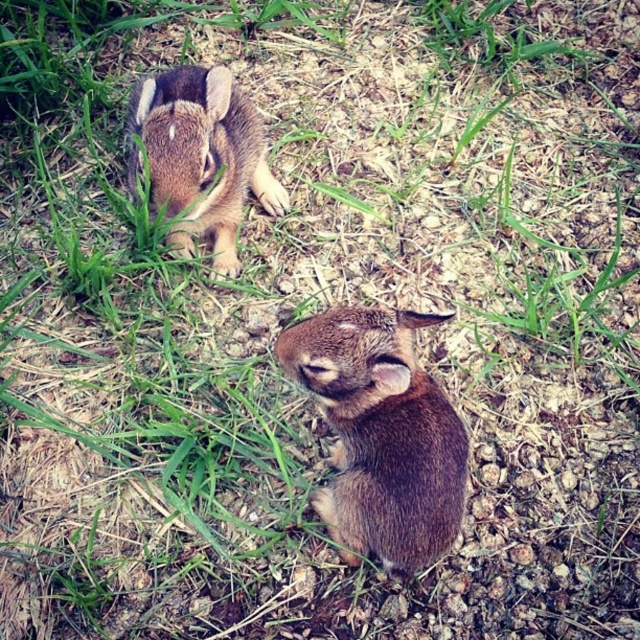
Question: Does brown furry rabbit at center come behind brown furry rabbit at upper left?

Choices:
 (A) no
 (B) yes

Answer: (A)

Question: Is brown furry rabbit at center closer to camera compared to brown furry rabbit at upper left?

Choices:
 (A) no
 (B) yes

Answer: (B)

Question: Which point is farther to the camera?

Choices:
 (A) (353, 346)
 (B) (246, 182)

Answer: (B)

Question: Is the position of brown furry rabbit at center more distant than that of brown furry rabbit at upper left?

Choices:
 (A) no
 (B) yes

Answer: (A)

Question: Which object is farther from the camera taking this photo?

Choices:
 (A) brown furry rabbit at upper left
 (B) brown furry rabbit at center

Answer: (A)

Question: Which point is farther to the camera?

Choices:
 (A) brown furry rabbit at center
 (B) brown furry rabbit at upper left

Answer: (B)